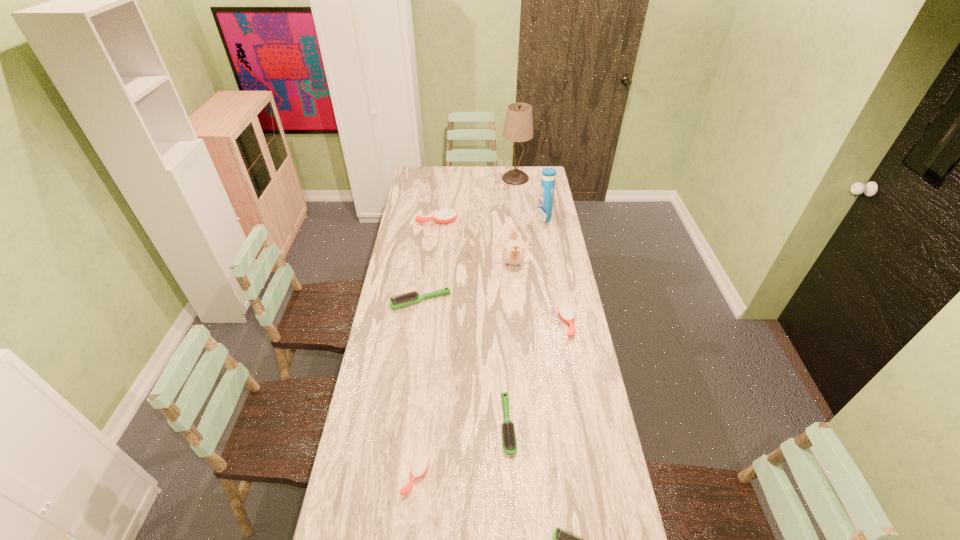
Where is `free point that satisfies the following two spatial constraints: 1. on the front-facing side of the detergent; 2. at the beak of the third tallest object`? The image size is (960, 540). free point that satisfies the following two spatial constraints: 1. on the front-facing side of the detergent; 2. at the beak of the third tallest object is located at coordinates (553, 266).

The width and height of the screenshot is (960, 540). I want to click on free space that satisfies the following two spatial constraints: 1. on the front-facing side of the second farthest orange hairbrush; 2. on the left side of the eighth shortest object, so click(564, 323).